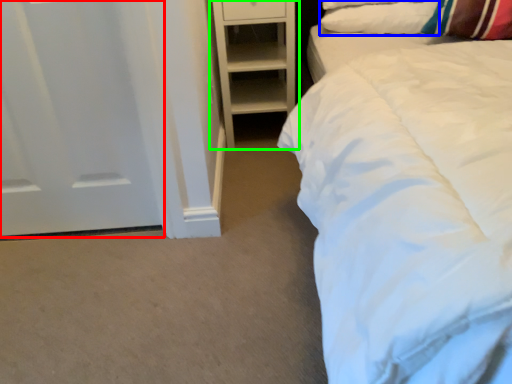
Question: Which is nearer to the door (highlighted by a red box)? pillow (highlighted by a blue box) or shelf (highlighted by a green box).

Choices:
 (A) pillow
 (B) shelf

Answer: (B)